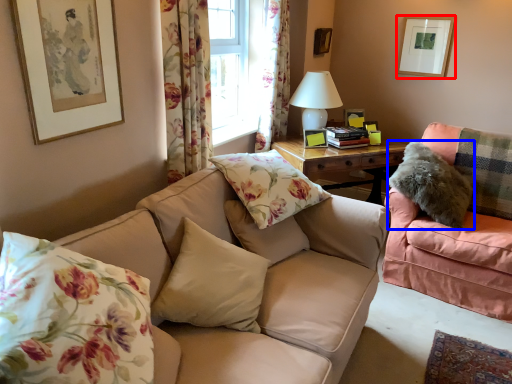
Question: Among these objects, which one is nearest to the camera, picture frame (highlighted by a red box) or pillow (highlighted by a blue box)?

Choices:
 (A) picture frame
 (B) pillow

Answer: (B)